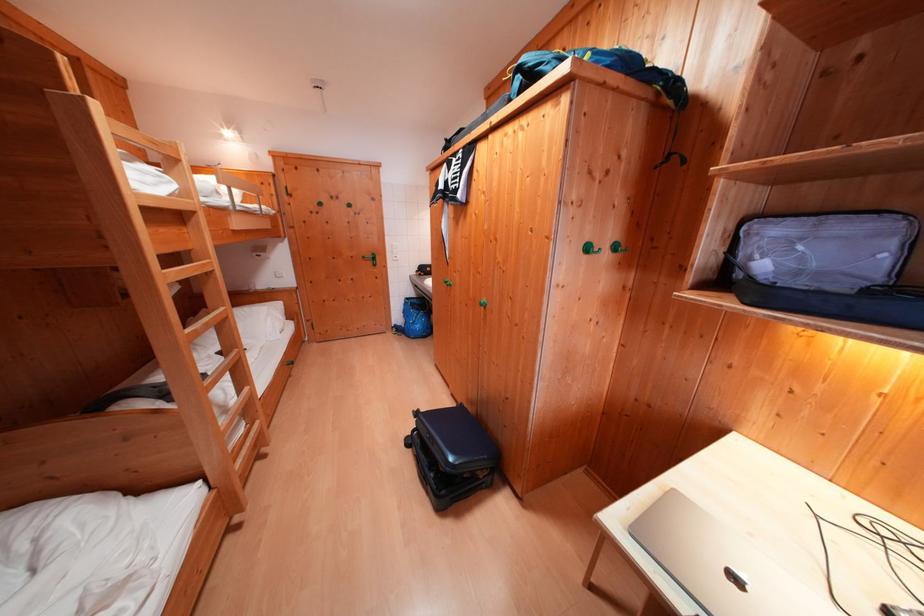
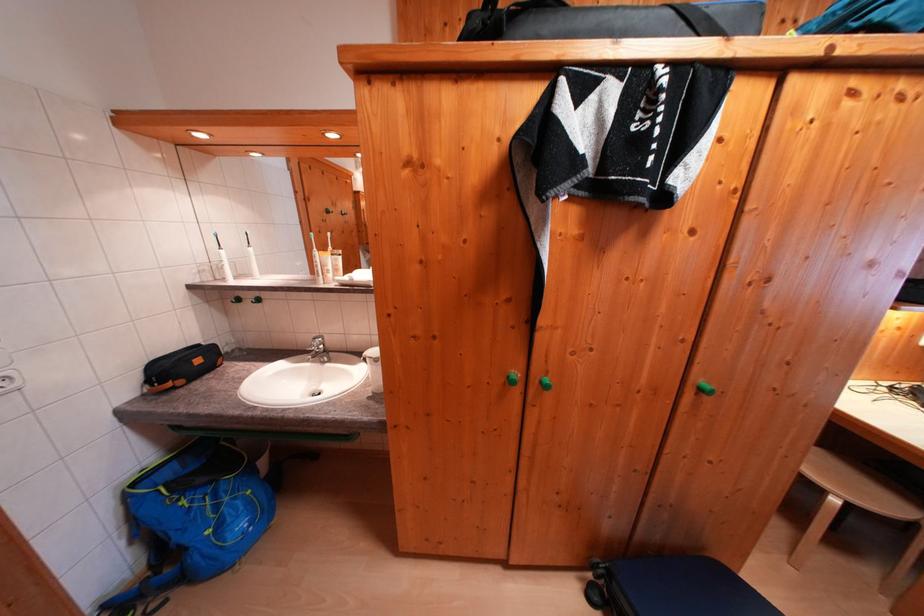
The point at (416, 302) is marked in the first image. Where is the corresponding point in the second image?

(142, 488)